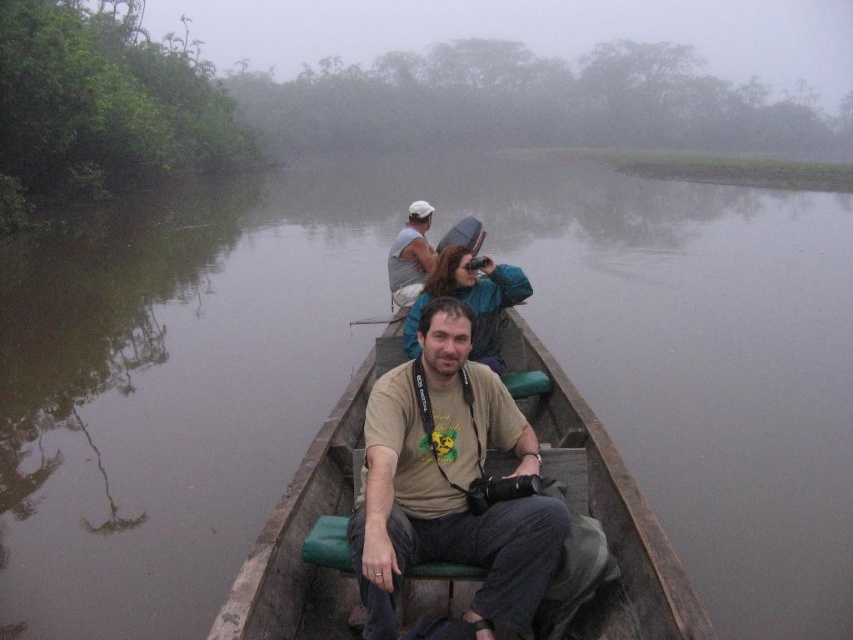
Who is shorter, wooden canoe at center or matte brown shirt at center?

matte brown shirt at center is shorter.

Is wooden canoe at center to the right of matte brown shirt at center from the viewer's perspective?

Correct, you'll find wooden canoe at center to the right of matte brown shirt at center.

Describe the element at coordinates (454, 508) in the screenshot. This screenshot has height=640, width=853. I see `wooden canoe at center` at that location.

At what (x,y) coordinates should I click in order to perform the action: click on wooden canoe at center. Please return your answer as a coordinate pair (x, y). Image resolution: width=853 pixels, height=640 pixels. Looking at the image, I should click on (454, 508).

Who is positioned more to the right, matte khaki t-shirt at center or matte brown shirt at center?

matte brown shirt at center

Does matte khaki t-shirt at center appear on the right side of matte brown shirt at center?

Incorrect, matte khaki t-shirt at center is not on the right side of matte brown shirt at center.

Is point (514, 547) behind point (476, 266)?

That is False.

Find the location of `matte khaki t-shirt at center`. matte khaki t-shirt at center is located at coordinates (450, 484).

Does wooden canoe at center appear on the left side of matte gray shirt at upper center?

No, wooden canoe at center is not to the left of matte gray shirt at upper center.

Is wooden canoe at center wider than matte gray shirt at upper center?

Yes, wooden canoe at center is wider than matte gray shirt at upper center.

Is point (256, 634) behind point (402, 284)?

No, (256, 634) is in front of (402, 284).

Find the location of `wooden canoe at center`. wooden canoe at center is located at coordinates (454, 508).